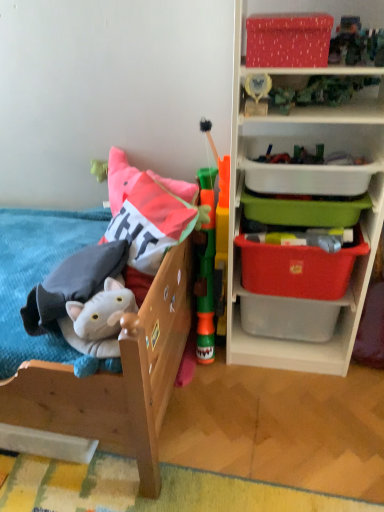
Locate an element on the screen. This screenshot has width=384, height=512. free space above matte red fabric storage box at upper right, the first storage box viewed from the top (from a real-world perspective) is located at coordinates (288, 10).